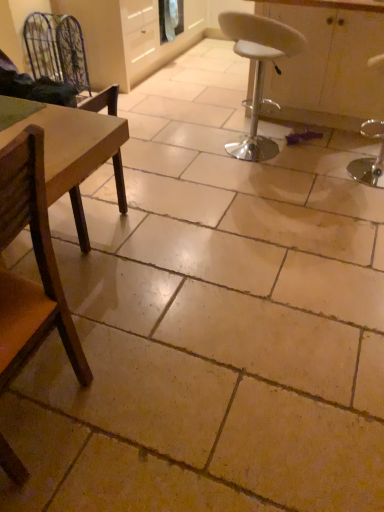
Describe the element at coordinates (258, 71) in the screenshot. I see `white plastic stool at center, the third chair positioned from the left` at that location.

The width and height of the screenshot is (384, 512). Describe the element at coordinates (37, 264) in the screenshot. I see `brown wooden chair at left, placed as the 2th chair when sorted from left to right` at that location.

The image size is (384, 512). Describe the element at coordinates (56, 49) in the screenshot. I see `metallic wire swivel chair at upper left` at that location.

The height and width of the screenshot is (512, 384). I want to click on wooden chair at left, the second chair in the back-to-front sequence, so click(x=80, y=156).

How many degrees apart are the facing directions of metallic wire swivel chair at upper left and white plastic stool at center, the first chair positioned from the back?

The angle between the facing direction of metallic wire swivel chair at upper left and the facing direction of white plastic stool at center, the first chair positioned from the back, is 83.2 degrees.

Where is `swivel chair above the white plastic stool at center, which is counted as the first chair, starting from the right (from the image's perspective)`? Image resolution: width=384 pixels, height=512 pixels. swivel chair above the white plastic stool at center, which is counted as the first chair, starting from the right (from the image's perspective) is located at coordinates (56, 49).

Who is more distant, metallic wire swivel chair at upper left or white plastic stool at center, which is counted as the first chair, starting from the right?

metallic wire swivel chair at upper left is more distant.

From the image's perspective, is metallic wire swivel chair at upper left above white plastic stool at center, the third chair viewed from the front?

Indeed, from the image's perspective, metallic wire swivel chair at upper left is shown above white plastic stool at center, the third chair viewed from the front.

Is wooden chair at left, the 3th chair positioned from the right, taller than metallic wire swivel chair at upper left?

Yes.

From a real-world perspective, who is located lower, wooden chair at left, the 3th chair positioned from the right, or metallic wire swivel chair at upper left?

metallic wire swivel chair at upper left, from a real-world perspective.

Considering the sizes of objects wooden chair at left, the second chair in the back-to-front sequence, and metallic wire swivel chair at upper left in the image provided, who is smaller, wooden chair at left, the second chair in the back-to-front sequence, or metallic wire swivel chair at upper left?

With smaller size is metallic wire swivel chair at upper left.

Is wooden chair at left, the 2th chair viewed from the front, turned away from metallic wire swivel chair at upper left?

wooden chair at left, the 2th chair viewed from the front, does not have its back to metallic wire swivel chair at upper left.

Is brown wooden chair at left, acting as the 2th chair starting from the right, directly adjacent to white plastic stool at center, which is counted as the first chair, starting from the right?

No, brown wooden chair at left, acting as the 2th chair starting from the right, is not in contact with white plastic stool at center, which is counted as the first chair, starting from the right.

Considering the sizes of objects brown wooden chair at left, acting as the 2th chair starting from the right, and white plastic stool at center, the third chair positioned from the left, in the image provided, who is thinner, brown wooden chair at left, acting as the 2th chair starting from the right, or white plastic stool at center, the third chair positioned from the left,?

Thinner between the two is white plastic stool at center, the third chair positioned from the left.

Is brown wooden chair at left, placed as the 2th chair when sorted from left to right, further to camera compared to white plastic stool at center, the third chair positioned from the left?

No, it is not.

From a real-world perspective, who is located lower, brown wooden chair at left, which is the first chair in front-to-back order, or white plastic stool at center, which is counted as the first chair, starting from the right?

white plastic stool at center, which is counted as the first chair, starting from the right, is physically lower.

Is wooden chair at left, placed as the 1th chair when sorted from left to right, positioned beyond the bounds of white plastic stool at center, the first chair positioned from the back?

Absolutely, wooden chair at left, placed as the 1th chair when sorted from left to right, is external to white plastic stool at center, the first chair positioned from the back.

From a real-world perspective, is wooden chair at left, the 3th chair positioned from the right, on white plastic stool at center, which is counted as the first chair, starting from the right?

No.

Does wooden chair at left, the 2th chair viewed from the front, have a smaller size compared to white plastic stool at center, the first chair positioned from the back?

Indeed, wooden chair at left, the 2th chair viewed from the front, has a smaller size compared to white plastic stool at center, the first chair positioned from the back.

How far apart are wooden chair at left, the 2th chair viewed from the front, and white plastic stool at center, the third chair positioned from the left?

wooden chair at left, the 2th chair viewed from the front, is 5.65 feet from white plastic stool at center, the third chair positioned from the left.

Is point (64, 74) closer or farther from the camera than point (34, 153)?

Point (64, 74) appears to be farther away from the viewer than point (34, 153).

Is metallic wire swivel chair at upper left oriented away from brown wooden chair at left, placed as the 2th chair when sorted from left to right?

No, metallic wire swivel chair at upper left is not facing away from brown wooden chair at left, placed as the 2th chair when sorted from left to right.

Who is bigger, metallic wire swivel chair at upper left or brown wooden chair at left, acting as the 2th chair starting from the right?

brown wooden chair at left, acting as the 2th chair starting from the right.

Do you think white glossy cabinet at center is within white plastic stool at center, the third chair positioned from the left, or outside of it?

white glossy cabinet at center is not inside white plastic stool at center, the third chair positioned from the left, it's outside.

From the image's perspective, which one is positioned lower, white glossy cabinet at center or white plastic stool at center, the third chair positioned from the left?

white plastic stool at center, the third chair positioned from the left.

Does white glossy cabinet at center have a smaller size compared to white plastic stool at center, the first chair positioned from the back?

No.

Looking at this image, from the image's perspective, which one is positioned higher, metallic wire swivel chair at upper left or white glossy cabinet at center?

metallic wire swivel chair at upper left.

Considering the relative positions of metallic wire swivel chair at upper left and white glossy cabinet at center in the image provided, is metallic wire swivel chair at upper left behind white glossy cabinet at center?

Yes, it is.

Where is `cabinetry that appears above the metallic wire swivel chair at upper left (from a real-world perspective)`? This screenshot has width=384, height=512. cabinetry that appears above the metallic wire swivel chair at upper left (from a real-world perspective) is located at coordinates (328, 64).

The image size is (384, 512). In order to click on swivel chair on the left of white plastic stool at center, the third chair viewed from the front in this screenshot , I will do `click(56, 49)`.

In order to click on swivel chair beneath the wooden chair at left, placed as the 1th chair when sorted from left to right (from a real-world perspective) in this screenshot , I will do `click(56, 49)`.

From the image, which object appears to be farther from wooden chair at left, placed as the 1th chair when sorted from left to right, metallic wire swivel chair at upper left or white glossy cabinet at center?

metallic wire swivel chair at upper left is positioned further to the anchor wooden chair at left, placed as the 1th chair when sorted from left to right.

When comparing their distances from wooden chair at left, the 2th chair viewed from the front, does metallic wire swivel chair at upper left or white plastic stool at center, the first chair positioned from the back, seem closer?

white plastic stool at center, the first chair positioned from the back.

Estimate the real-world distances between objects in this image. Which object is further from white plastic stool at center, the first chair positioned from the back, white glossy cabinet at center or wooden chair at left, the second chair in the back-to-front sequence?

wooden chair at left, the second chair in the back-to-front sequence, lies further to white plastic stool at center, the first chair positioned from the back, than the other object.

Looking at the image, which one is located closer to metallic wire swivel chair at upper left, brown wooden chair at left, which ranks as the third chair in back-to-front order, or white glossy cabinet at center?

white glossy cabinet at center is positioned closer to the anchor metallic wire swivel chair at upper left.

From the image, which object appears to be nearer to wooden chair at left, the 3th chair positioned from the right, white glossy cabinet at center or brown wooden chair at left, acting as the 2th chair starting from the right?

brown wooden chair at left, acting as the 2th chair starting from the right, is positioned closer to the anchor wooden chair at left, the 3th chair positioned from the right.

Considering their positions, is wooden chair at left, the 2th chair viewed from the front, positioned closer to white glossy cabinet at center than brown wooden chair at left, acting as the 2th chair starting from the right?

Among the two, wooden chair at left, the 2th chair viewed from the front, is located nearer to white glossy cabinet at center.

Looking at the image, which one is located further to wooden chair at left, the 2th chair viewed from the front, brown wooden chair at left, acting as the 2th chair starting from the right, or white glossy cabinet at center?

The object further to wooden chair at left, the 2th chair viewed from the front, is white glossy cabinet at center.

Estimate the real-world distances between objects in this image. Which object is closer to white plastic stool at center, the third chair positioned from the left, wooden chair at left, the 3th chair positioned from the right, or brown wooden chair at left, which ranks as the third chair in back-to-front order?

Among the two, wooden chair at left, the 3th chair positioned from the right, is located nearer to white plastic stool at center, the third chair positioned from the left.

Identify the location of chair located between brown wooden chair at left, placed as the 2th chair when sorted from left to right, and white plastic stool at center, the third chair viewed from the front, in the depth direction. This screenshot has width=384, height=512. click(x=80, y=156).

The width and height of the screenshot is (384, 512). Find the location of `cabinetry between brown wooden chair at left, which ranks as the third chair in back-to-front order, and metallic wire swivel chair at upper left from front to back`. cabinetry between brown wooden chair at left, which ranks as the third chair in back-to-front order, and metallic wire swivel chair at upper left from front to back is located at coordinates (328, 64).